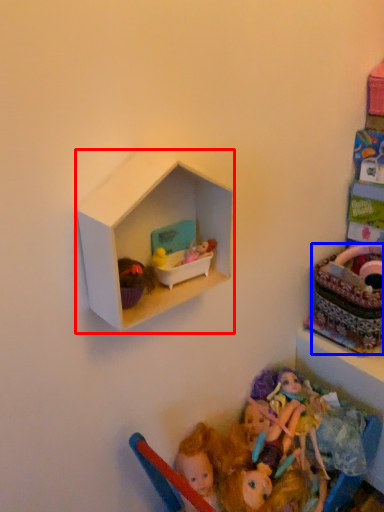
Question: Among these objects, which one is nearest to the camera, shelf (highlighted by a red box) or basket (highlighted by a blue box)?

Choices:
 (A) shelf
 (B) basket

Answer: (A)